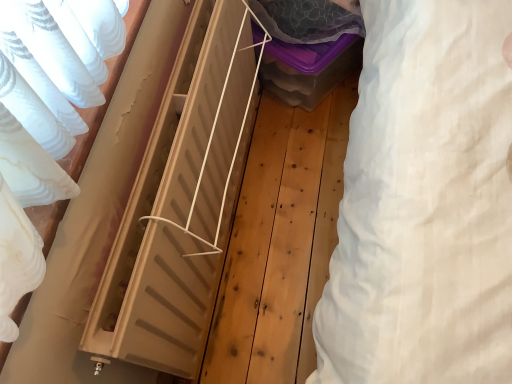
Image resolution: width=512 pixels, height=384 pixels. Identify the location of free space above natural wood radiator at center (from a real-world perspective). (164, 111).